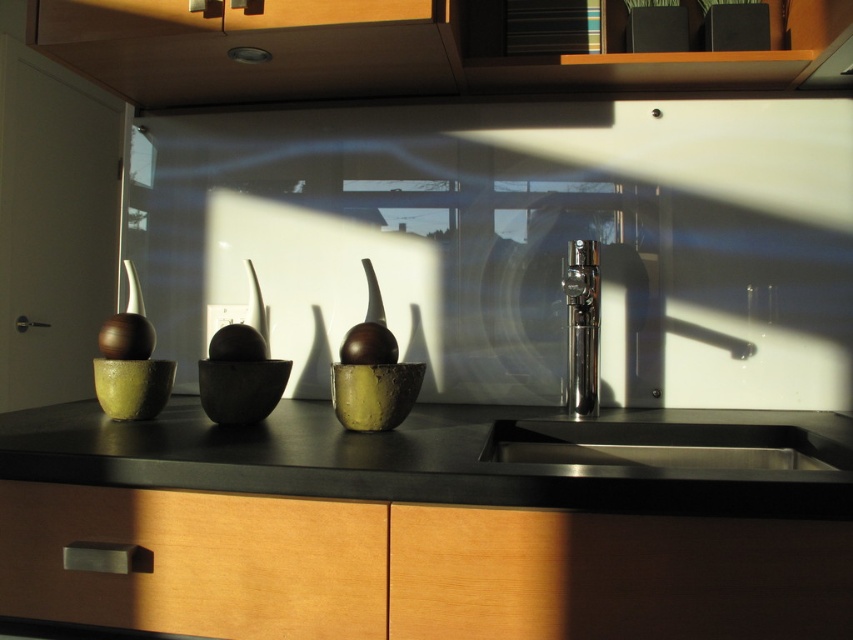
Question: Which of the following is the closest to the observer?

Choices:
 (A) wooden drawer at lower left
 (B) black matte counter top at center
 (C) black matte countertop at center
 (D) stainless steel sink at lower center

Answer: (C)

Question: Is black matte countertop at center to the right of stainless steel sink at center from the viewer's perspective?

Choices:
 (A) no
 (B) yes

Answer: (A)

Question: Which of the following is the farthest from the observer?

Choices:
 (A) shiny metallic vase at center
 (B) black matte counter top at center
 (C) polished chrome faucet at center
 (D) wooden drawer at lower left

Answer: (C)

Question: Does stainless steel sink at center have a larger size compared to matte brown bowl at center?

Choices:
 (A) no
 (B) yes

Answer: (B)

Question: Is black matte countertop at center to the right of stainless steel sink at center from the viewer's perspective?

Choices:
 (A) yes
 (B) no

Answer: (B)

Question: Which object is the farthest from the black matte counter top at center?

Choices:
 (A) black matte countertop at center
 (B) shiny metallic vase at center

Answer: (B)